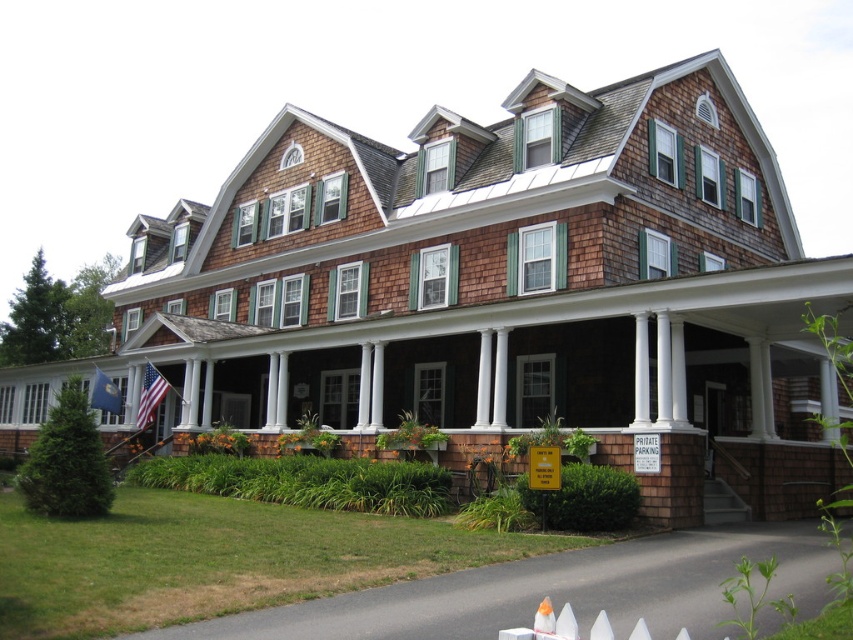
You are a guest arriving at the house and notice both the american flag at left and the blue fabric flag at lower left. Which flag has a smaller width when viewed from your perspective?

The american flag at left is thinner than the blue fabric flag at lower left, so the american flag at left has a smaller width.

You are standing on the front porch of the house and want to hang a new flag. You have two options to place them so they are both visible from the street. The american flag at left and the blue fabric flag at lower left must be positioned according to their current distances from you. Which flag should you place closer to the edge of the porch to ensure both are visible?

The american flag at left is already closer to the viewer than the blue fabric flag at lower left. To ensure both flags are visible from the street, you should keep the american flag at left closer to the edge of the porch since it is nearer to the viewer, maintaining their relative positions.

Looking at this image, you are standing on the front porch of the house and see both the american flag at left and the blue fabric flag at lower left. Which flag is closer to the center of the porch?

The blue fabric flag at lower left is closer to the center of the porch because the american flag at left is positioned to its right side, meaning the blue fabric flag is nearer to the central area.